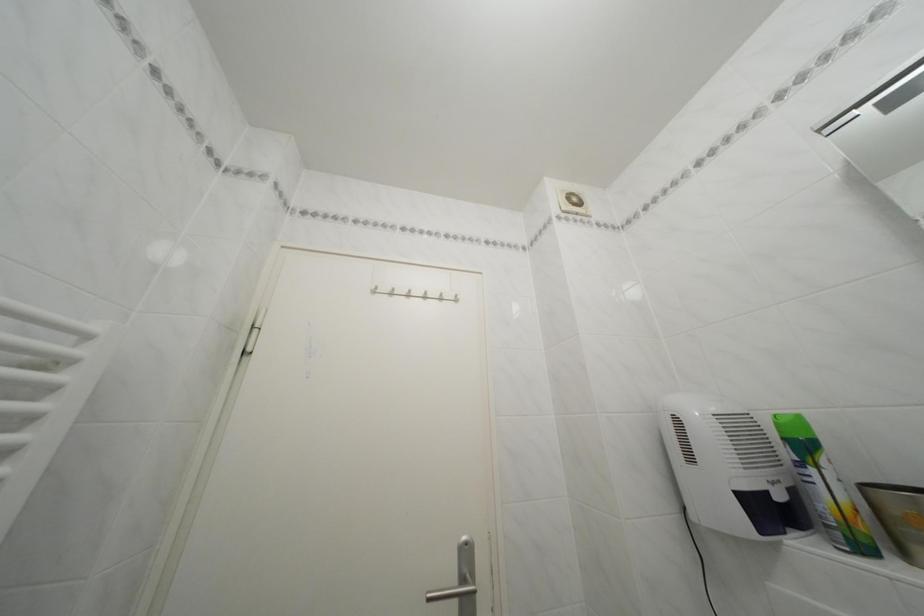
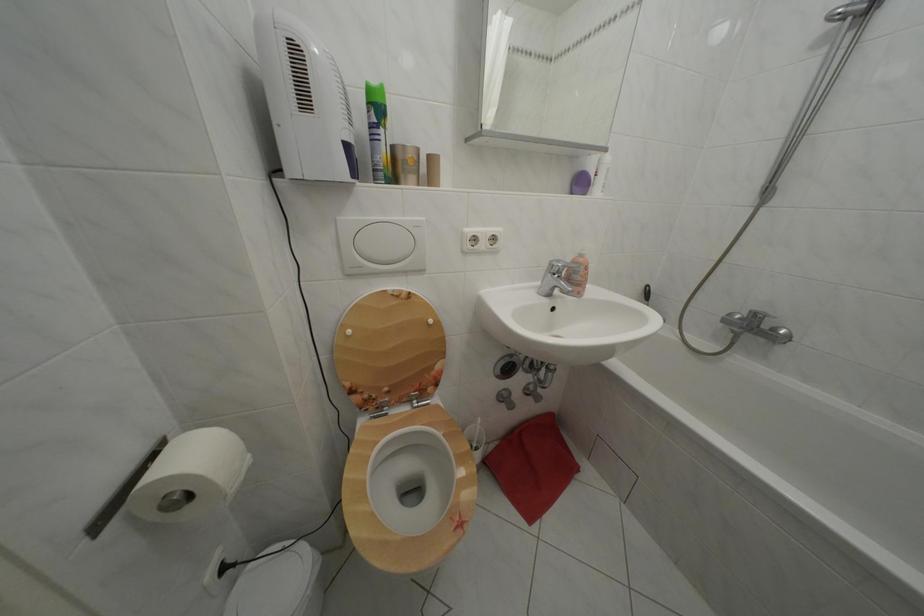
Find the pixel in the second image that matches (x=793, y=445) in the first image.

(378, 110)